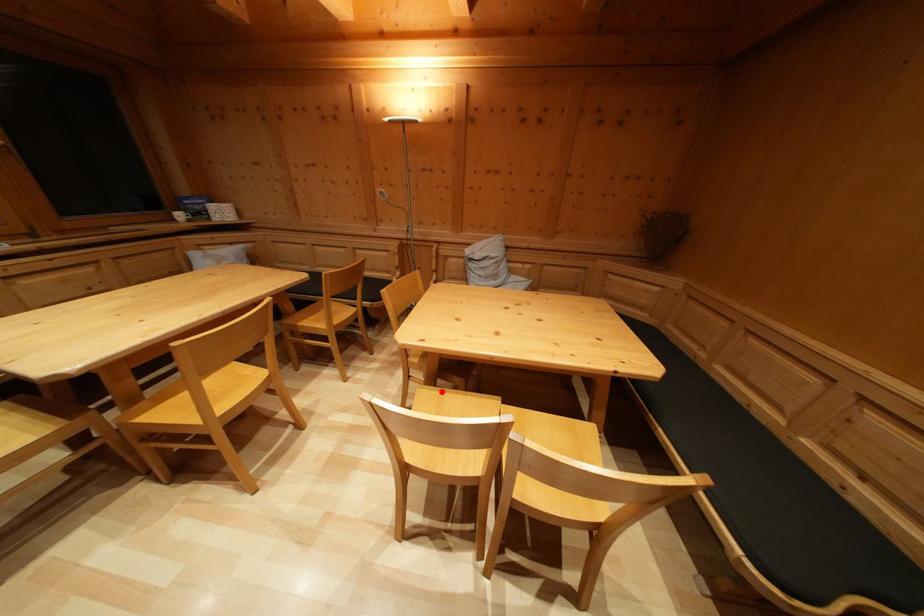
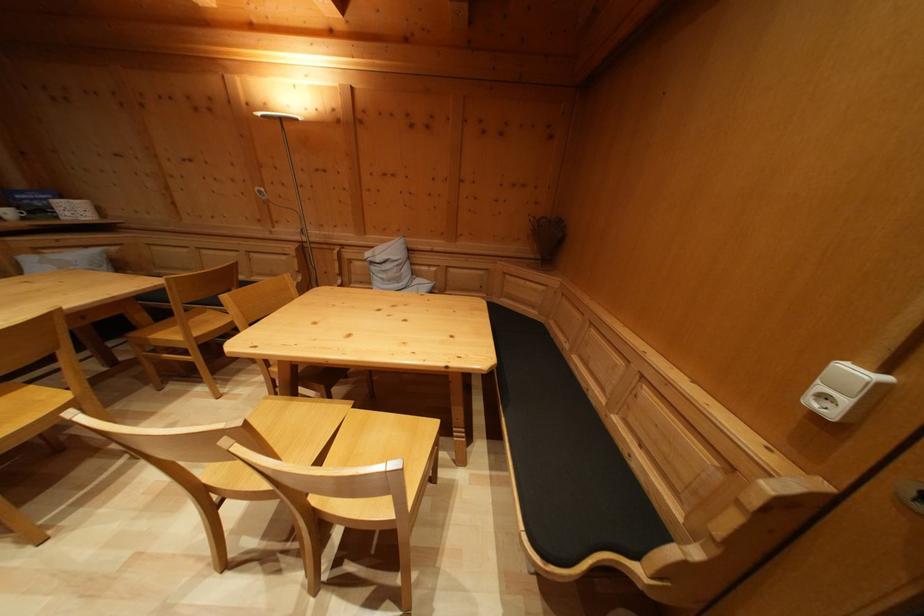
Where in the second image is the point corresponding to the highlighted location from the first image?

(300, 400)